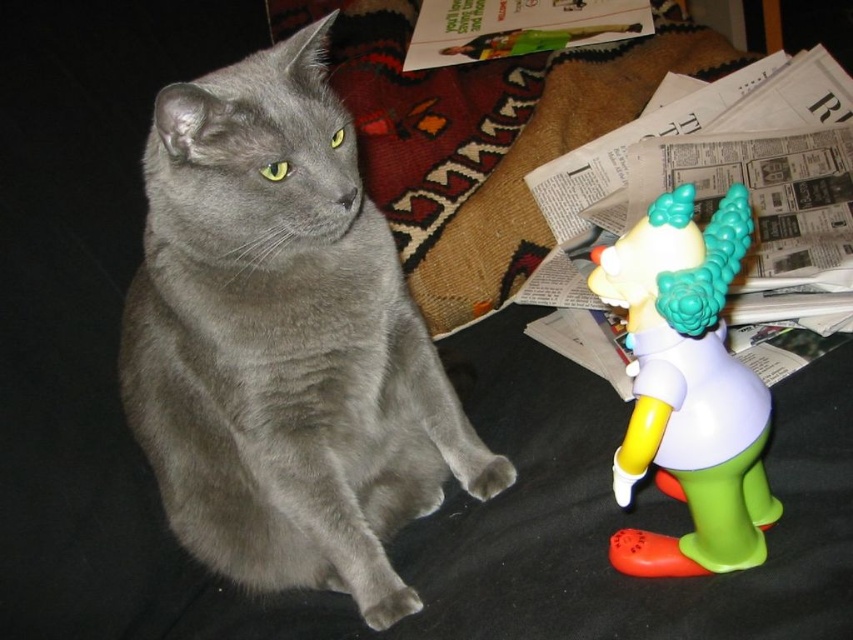
You are a toy collector who wants to place your new matte plastic unicorn at right next to your matte gray cat at center. Given that the shelf you have can only accommodate items up to 16 inches apart, will the two items fit on the shelf without exceeding the space?

The matte gray cat at center and the matte plastic unicorn at right are 16.20 inches apart, which exceeds the 16 inches limit. Therefore, they will not fit on the shelf without exceeding the space.

You are a cat owner who wants to ensure your cat stays safe. Your cat is currently sitting on a couch. There is a matte plastic unicorn at right and a matte gray cat at center. Which object is positioned to the left of the other?

The matte gray cat at center is positioned to the left of the matte plastic unicorn at right.